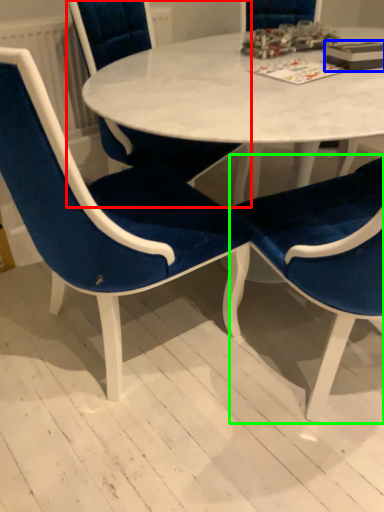
Question: Estimate the real-world distances between objects in this image. Which object is farther from chair (highlighted by a red box), book (highlighted by a blue box) or chair (highlighted by a green box)?

Choices:
 (A) book
 (B) chair

Answer: (A)